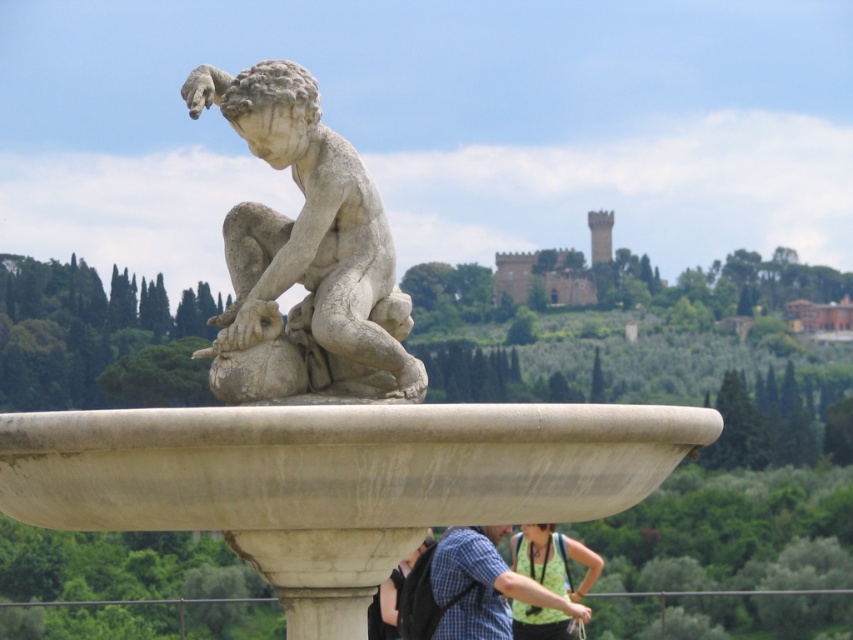
You are an artist trying to sketch the scene. You notice two items at the lower center of the image. Which one is wider, the green fabric top at lower center or the matte black shirt at lower center?

The green fabric top at lower center might be wider than the matte black shirt at lower center.

You are an artist trying to sketch the scene. You notice the white marble statue at center and the matte black shirt at lower center. Which object is shorter in height?

The white marble statue at center has a lesser height compared to the matte black shirt at lower center, so the white marble statue at center is shorter.

You are standing in front of the classical stone fountain and notice the white marble statue at center and the matte black shirt at lower center. From your perspective, which object is closer to you?

The white marble statue at center is closer to you because the matte black shirt at lower center is behind it.